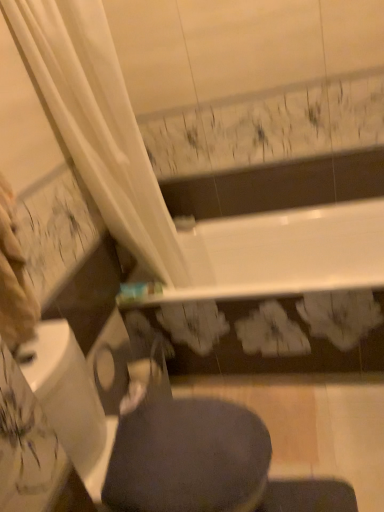
Question: Is dark gray fabric swivel chair at lower center bigger or smaller than dark gray fabric at lower center?

Choices:
 (A) small
 (B) big

Answer: (B)

Question: Choose the correct answer: Is dark gray fabric swivel chair at lower center inside dark gray fabric at lower center or outside it?

Choices:
 (A) outside
 (B) inside

Answer: (A)

Question: Considering the positions of dark gray fabric swivel chair at lower center and dark gray fabric at lower center in the image, is dark gray fabric swivel chair at lower center wider or thinner than dark gray fabric at lower center?

Choices:
 (A) wide
 (B) thin

Answer: (A)

Question: Is point (195, 429) closer or farther from the camera than point (97, 494)?

Choices:
 (A) farther
 (B) closer

Answer: (A)

Question: Is dark gray fabric at lower center to the left or to the right of dark gray fabric swivel chair at lower center in the image?

Choices:
 (A) left
 (B) right

Answer: (B)

Question: From the image's perspective, is dark gray fabric at lower center positioned above or below dark gray fabric swivel chair at lower center?

Choices:
 (A) above
 (B) below

Answer: (A)

Question: Relative to dark gray fabric swivel chair at lower center, is dark gray fabric at lower center in front or behind?

Choices:
 (A) front
 (B) behind

Answer: (B)